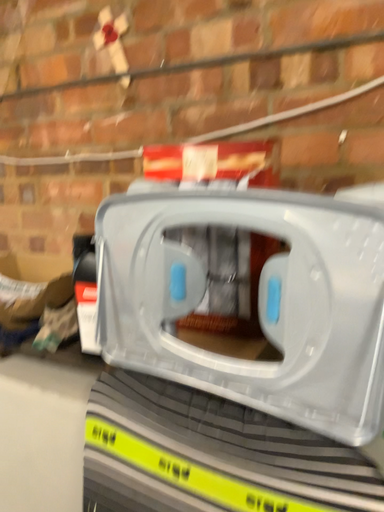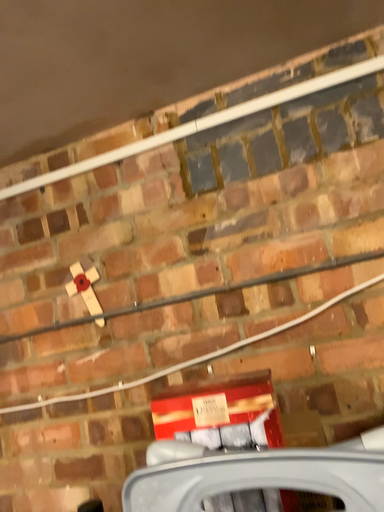
Question: Which way did the camera rotate in the video?

Choices:
 (A) rotated left
 (B) rotated right

Answer: (B)